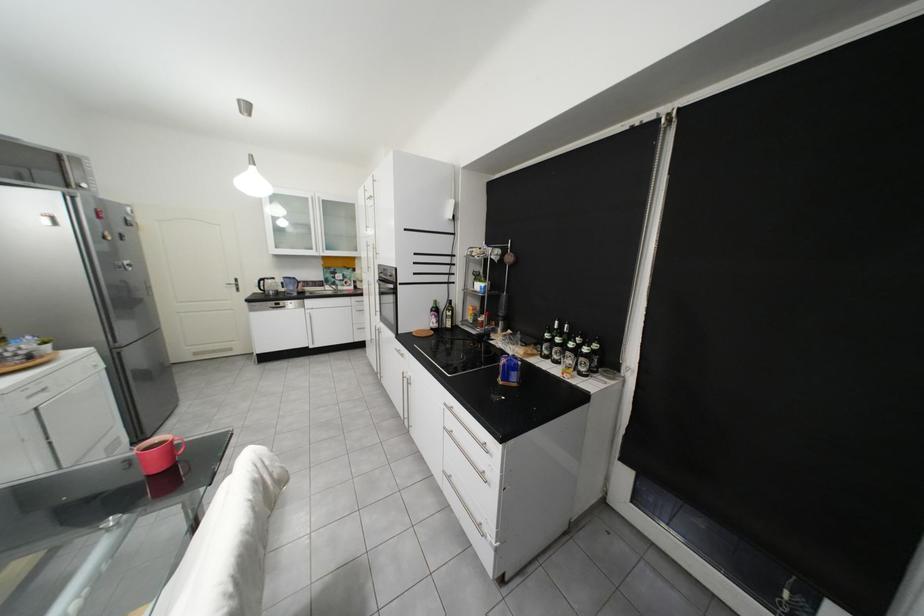
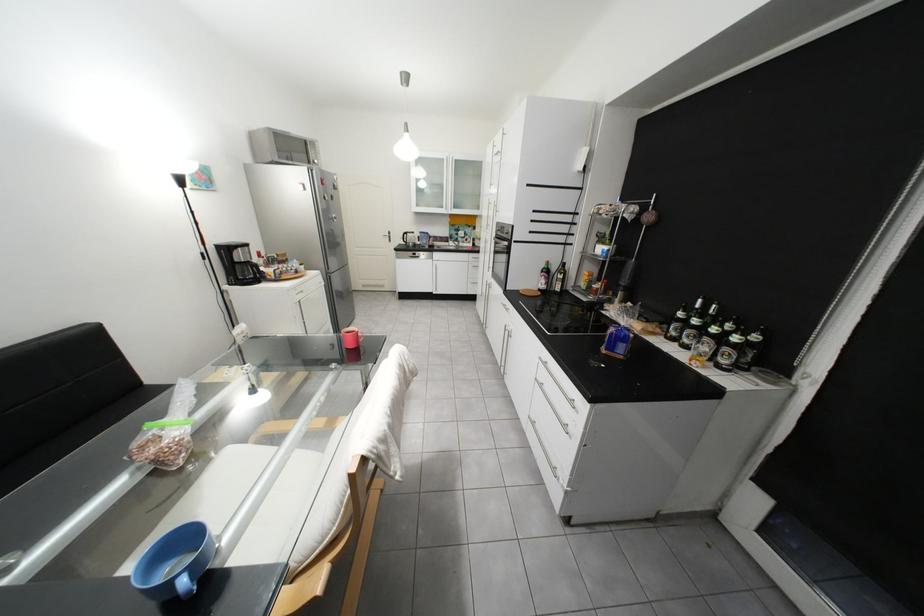
Locate, in the second image, the point that corresponds to (598,351) in the first image.

(747, 339)